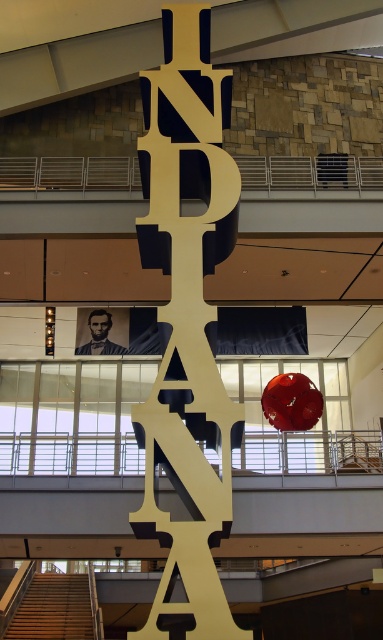
Does gold metallic letters at center lie in front of smooth skin portrait at center?

Yes, gold metallic letters at center is closer to the viewer.

How distant is gold metallic letters at center from smooth skin portrait at center?

14.93 meters

Is point (165, 428) farther from camera compared to point (91, 326)?

No, it is not.

You are a GUI agent. You are given a task and a screenshot of the screen. Output one action in this format:
    pyautogui.click(x=<x>, y=<y>)
    Task: Click on the gold metallic letters at center
    The width and height of the screenshot is (383, 640).
    Given the screenshot: What is the action you would take?
    pyautogui.click(x=186, y=324)